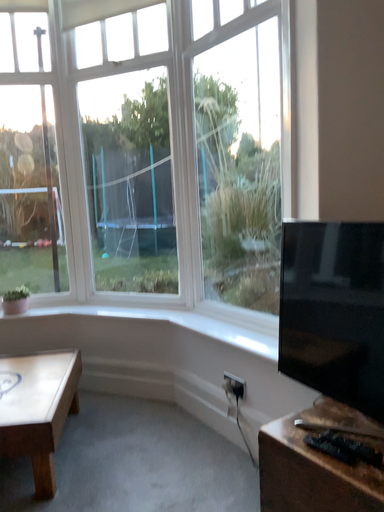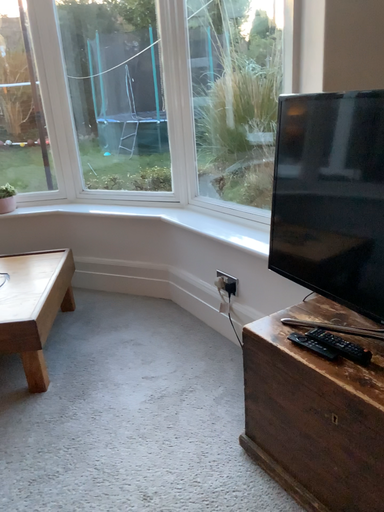
Question: How did the camera likely rotate when shooting the video?

Choices:
 (A) rotated downward
 (B) rotated upward

Answer: (A)